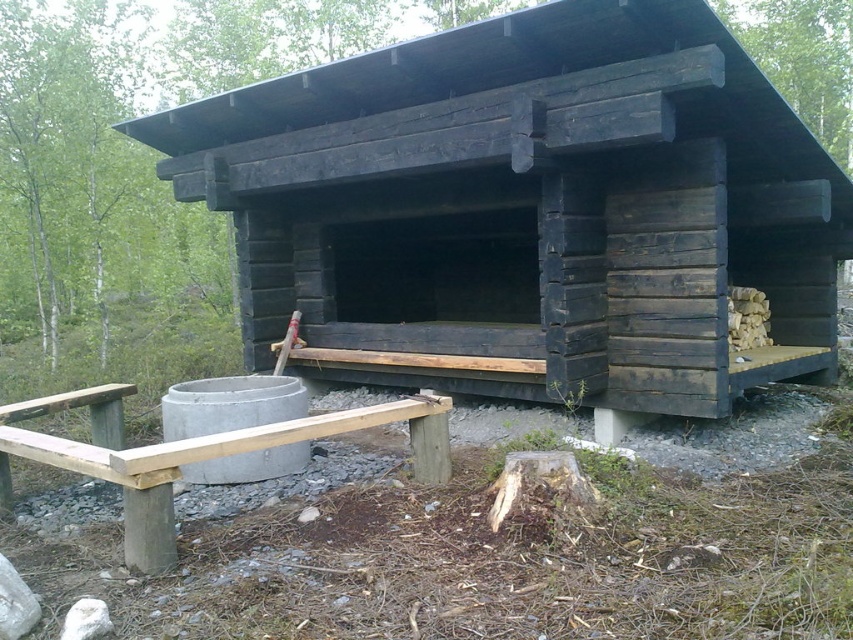
Question: Where is black wood hut at center located in relation to wooden picnic table at lower left in the image?

Choices:
 (A) left
 (B) right

Answer: (B)

Question: Is black wood hut at center above wooden picnic table at lower left?

Choices:
 (A) no
 (B) yes

Answer: (B)

Question: Is black wood hut at center wider than wooden picnic table at lower left?

Choices:
 (A) yes
 (B) no

Answer: (A)

Question: Which object appears closest to the camera in this image?

Choices:
 (A) black wood hut at center
 (B) wooden picnic table at lower left

Answer: (B)